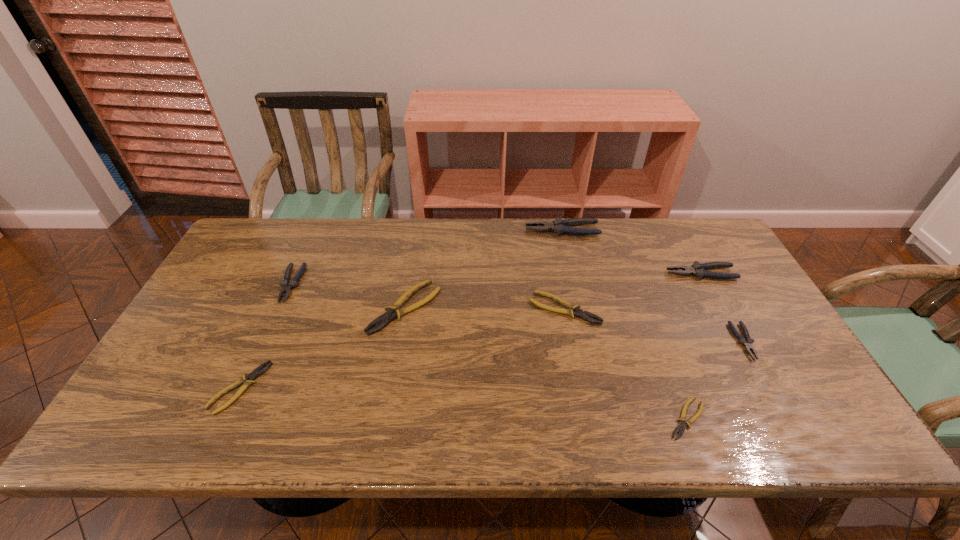
You are a GUI agent. You are given a task and a screenshot of the screen. Output one action in this format:
    pyautogui.click(x=<x>, y=<y>)
    Task: Click on the tallest pliers
    
    Given the screenshot: What is the action you would take?
    pyautogui.click(x=559, y=226)

Where is `the farthest object`? the farthest object is located at coordinates (559, 226).

Image resolution: width=960 pixels, height=540 pixels. I want to click on the second tallest pliers, so click(x=699, y=270).

Locate an element on the screen. the second tallest object is located at coordinates (699, 270).

The width and height of the screenshot is (960, 540). Identify the location of the leftmost gray pliers. (286, 286).

Image resolution: width=960 pixels, height=540 pixels. What are the coordinates of `the sixth pliers from right to left` in the screenshot? It's located at (394, 311).

Identify the location of the second yellow pliers from left to right. This screenshot has width=960, height=540. (394, 311).

Locate an element on the screen. This screenshot has height=540, width=960. the second biggest yellow pliers is located at coordinates (584, 315).

At what (x,y) coordinates should I click in order to perform the action: click on the smallest gray pliers. Please return your answer as a coordinate pair (x, y). Looking at the image, I should click on tap(747, 341).

Locate an element on the screen. the second shortest object is located at coordinates (258, 371).